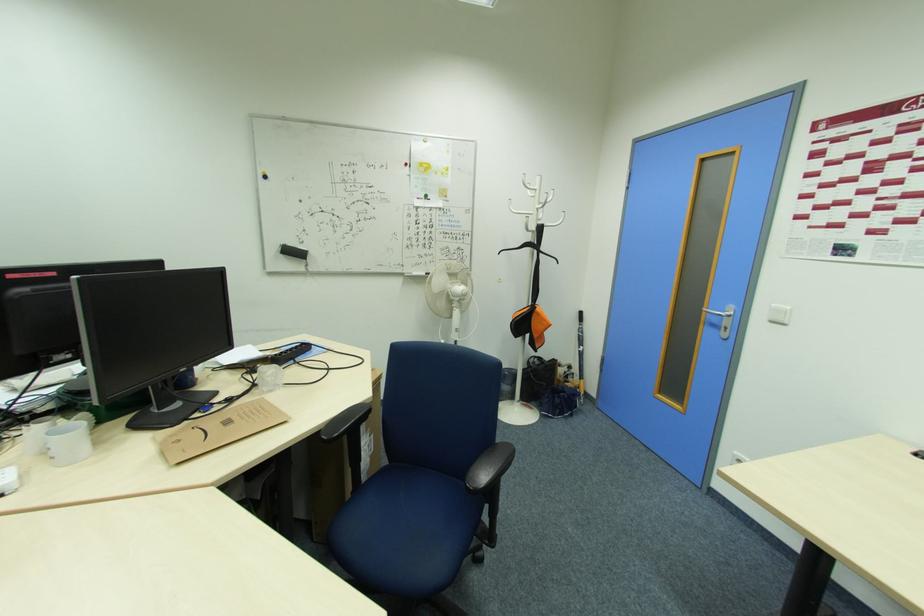
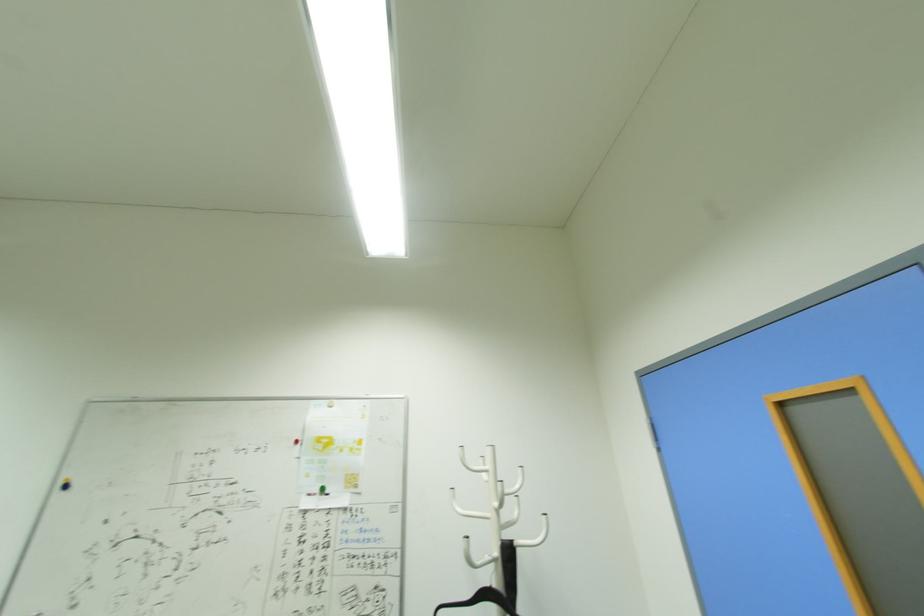
The point at (549, 225) is marked in the first image. Where is the corresponding point in the second image?

(518, 544)